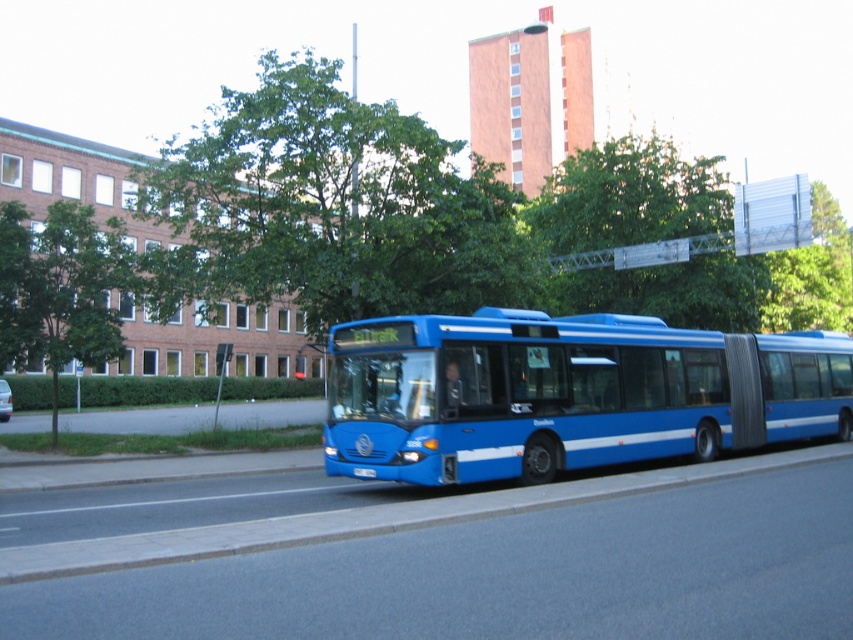
Which is more to the left, gray asphalt curb at lower center or green leafy tree at upper right?

From the viewer's perspective, gray asphalt curb at lower center appears more on the left side.

Identify the location of gray asphalt curb at lower center. The width and height of the screenshot is (853, 640). (370, 518).

Is point (817, 337) behind point (839, 244)?

No, it is not.

Image resolution: width=853 pixels, height=640 pixels. In order to click on blue metallic bus at center in this screenshot , I will do `click(566, 394)`.

Identify the location of blue metallic bus at center. (566, 394).

This screenshot has width=853, height=640. Describe the element at coordinates (566, 394) in the screenshot. I see `blue metallic bus at center` at that location.

Which is behind, point (635, 316) or point (77, 253)?

The point (77, 253) is behind.

Where is `blue metallic bus at center`? This screenshot has height=640, width=853. blue metallic bus at center is located at coordinates (566, 394).